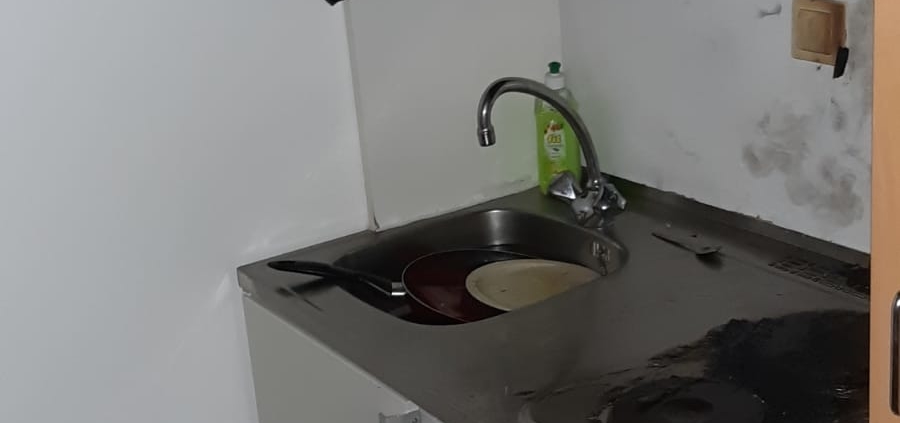
Where is `vent`? vent is located at coordinates (814, 274).